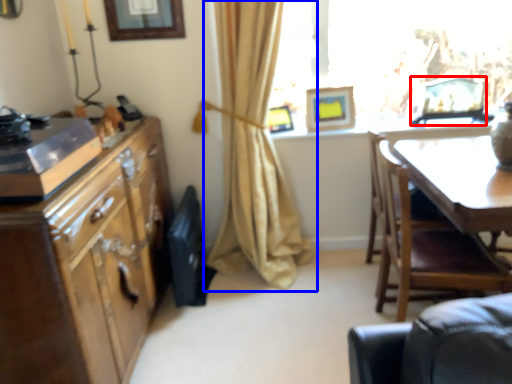
Question: Which of the following is the closest to the observer, picture frame (highlighted by a red box) or curtain (highlighted by a blue box)?

Choices:
 (A) picture frame
 (B) curtain

Answer: (B)